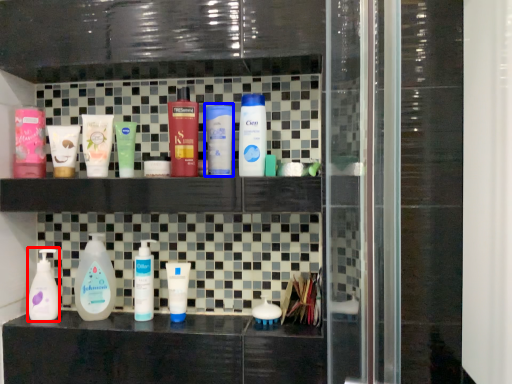
Question: Which of the following is the farthest to the observer, cleaning product (highlighted by a red box) or toiletry (highlighted by a blue box)?

Choices:
 (A) cleaning product
 (B) toiletry

Answer: (A)